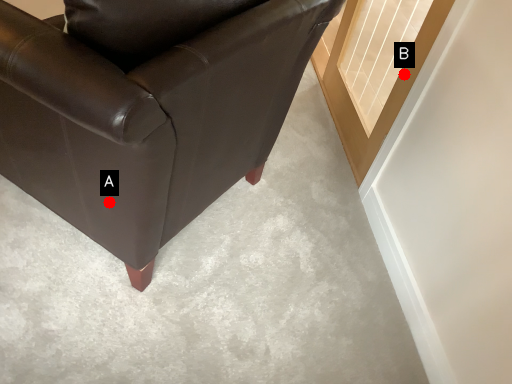
Question: Two points are circled on the image, labeled by A and B beside each circle. Which point is further to the camera?

Choices:
 (A) A is further
 (B) B is further

Answer: (B)